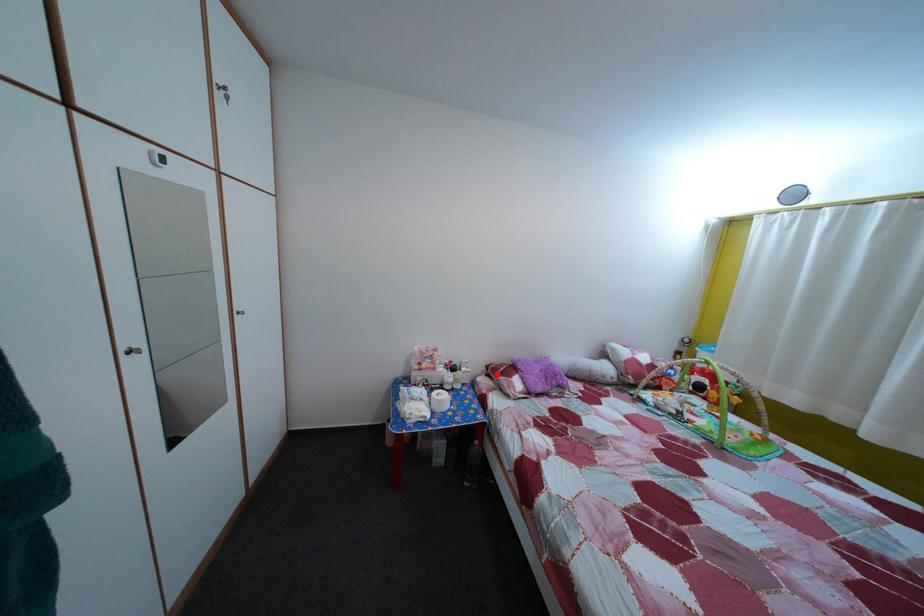
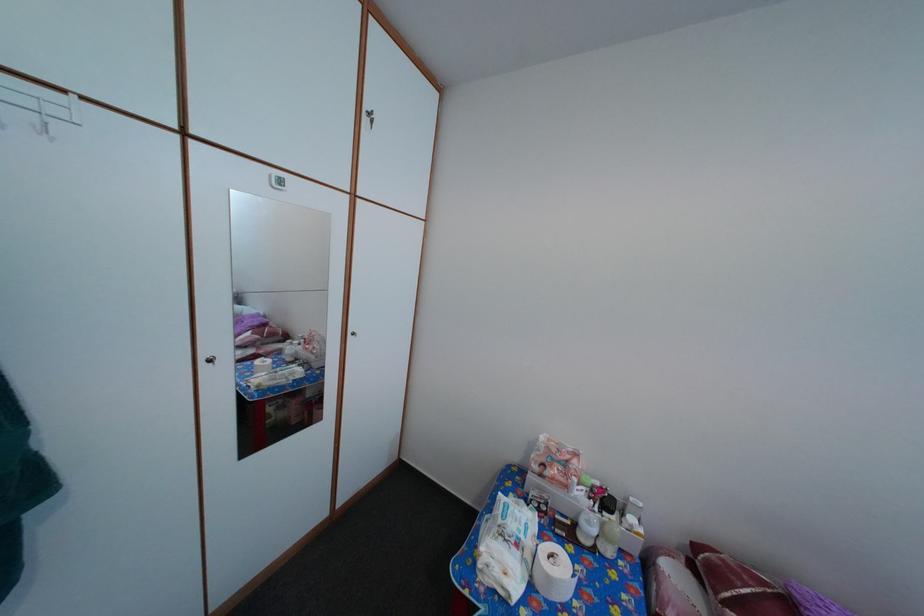
Question: I am providing you with two images of the same scene from different viewpoints. A red point is marked on the first image. At the location where the point appears in image 1, is it still visible in image 2?

Choices:
 (A) Yes
 (B) No

Answer: (A)